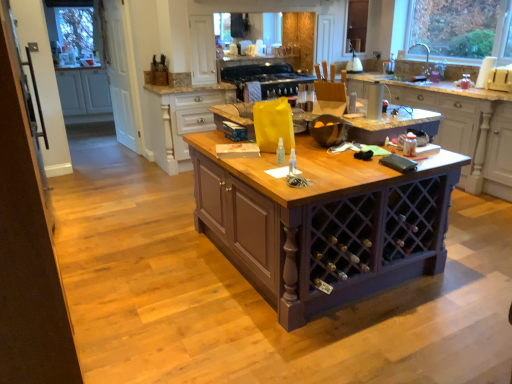
In order to face black matte bowl at center, positioned as the 2th appliance in right-to-left order, should I rotate leftwards or rightwards?

Rotate right and turn 10.013 degrees.

Where is `white glossy kettle at upper center, which ranks as the 2th appliance in bottom-to-top order`? The height and width of the screenshot is (384, 512). white glossy kettle at upper center, which ranks as the 2th appliance in bottom-to-top order is located at coordinates (354, 64).

What is the approximate height of white glossy kettle at upper center, which ranks as the 2th appliance in bottom-to-top order?

The height of white glossy kettle at upper center, which ranks as the 2th appliance in bottom-to-top order, is 11.17 inches.

This screenshot has width=512, height=384. Describe the element at coordinates (182, 119) in the screenshot. I see `white wood cabinet at upper center, which is the 2th cabinetry from back to front` at that location.

You are a GUI agent. You are given a task and a screenshot of the screen. Output one action in this format:
    pyautogui.click(x=<x>, y=<y>)
    Task: Click on the black matte bowl at center, positioned as the 2th appliance in right-to-left order
    
    Given the screenshot: What is the action you would take?
    pyautogui.click(x=329, y=130)

From the image's perspective, is clear glass window at upper right over white matte cabinet at left, the 1th cabinetry from the left?

Yes, from the image's perspective, clear glass window at upper right is over white matte cabinet at left, the 1th cabinetry from the left.

Is clear glass window at upper right directly adjacent to white matte cabinet at left, the first cabinetry from the back?

No, clear glass window at upper right is not next to white matte cabinet at left, the first cabinetry from the back.

Looking at the image, does clear glass window at upper right seem bigger or smaller compared to white matte cabinet at left, the 1th cabinetry from the left?

Considering their sizes, clear glass window at upper right takes up less space than white matte cabinet at left, the 1th cabinetry from the left.

From their relative heights in the image, would you say white glossy kettle at upper center, which is the first appliance in right-to-left order, is taller or shorter than clear glass window at upper right?

In the image, white glossy kettle at upper center, which is the first appliance in right-to-left order, appears to be shorter than clear glass window at upper right.

Looking at this image, considering the relative sizes of white glossy kettle at upper center, which ranks as the 2th appliance in bottom-to-top order, and clear glass window at upper right in the image provided, is white glossy kettle at upper center, which ranks as the 2th appliance in bottom-to-top order, thinner than clear glass window at upper right?

No, white glossy kettle at upper center, which ranks as the 2th appliance in bottom-to-top order, is not thinner than clear glass window at upper right.

Can clear glass window at upper right be found inside white glossy kettle at upper center, acting as the second appliance starting from the left?

No, clear glass window at upper right is not a part of white glossy kettle at upper center, acting as the second appliance starting from the left.

Considering the points (360, 61) and (500, 18), which point is behind, point (360, 61) or point (500, 18)?

The point (360, 61) is behind.

Is purple wood cabinet at center, the 1th cabinetry in the front-to-back sequence, completely or partially outside of purple wood table at center?

purple wood cabinet at center, the 1th cabinetry in the front-to-back sequence, lies outside purple wood table at center's area.

Is purple wood cabinet at center, the first cabinetry from the right, in contact with purple wood table at center?

No, purple wood cabinet at center, the first cabinetry from the right, is not touching purple wood table at center.

Measure the distance from purple wood cabinet at center, marked as the 3th cabinetry in a back-to-front arrangement, to purple wood table at center.

purple wood cabinet at center, marked as the 3th cabinetry in a back-to-front arrangement, is 6.60 feet from purple wood table at center.

Where is `table lying below the purple wood cabinet at center, the first cabinetry from the right (from the image's perspective)`? The width and height of the screenshot is (512, 384). table lying below the purple wood cabinet at center, the first cabinetry from the right (from the image's perspective) is located at coordinates (322, 223).

Which of these two, black matte bowl at center, the first appliance viewed from the front, or white glossy kettle at upper center, the 2th appliance when ordered from front to back, is thinner?

white glossy kettle at upper center, the 2th appliance when ordered from front to back, is thinner.

Does point (341, 142) appear closer or farther from the camera than point (352, 59)?

Point (341, 142) is closer to the camera than point (352, 59).

Is black matte bowl at center, marked as the 2th appliance in a top-to-bottom arrangement, further to the viewer compared to white glossy kettle at upper center, the 1th appliance in the back-to-front sequence?

No, the depth of black matte bowl at center, marked as the 2th appliance in a top-to-bottom arrangement, is less than that of white glossy kettle at upper center, the 1th appliance in the back-to-front sequence.

Based on the photo, from a real-world perspective, which object rests below the other?

black matte bowl at center, the 1th appliance viewed from the left, is physically lower.

Who is shorter, purple wood cabinet at center, marked as the 3th cabinetry in a back-to-front arrangement, or white matte cabinet at left, the 1th cabinetry from the left?

white matte cabinet at left, the 1th cabinetry from the left, is shorter.

Could you tell me if purple wood cabinet at center, the first cabinetry from the right, is turned towards white matte cabinet at left, the 1th cabinetry from the left?

No, purple wood cabinet at center, the first cabinetry from the right, is not oriented towards white matte cabinet at left, the 1th cabinetry from the left.

Locate an element on the screen. The image size is (512, 384). cabinetry that is the 2nd object located above the purple wood cabinet at center, which ranks as the third cabinetry in left-to-right order (from the image's perspective) is located at coordinates [84, 91].

Is white wood cabinet at upper center, marked as the second cabinetry in a front-to-back arrangement, not inside clear glass window at upper right?

Yes, white wood cabinet at upper center, marked as the second cabinetry in a front-to-back arrangement, is located beyond the bounds of clear glass window at upper right.

The image size is (512, 384). Find the location of `cabinetry that is the 2nd one when counting leftward from the clear glass window at upper right`. cabinetry that is the 2nd one when counting leftward from the clear glass window at upper right is located at coordinates (182, 119).

Which of these two, white wood cabinet at upper center, which is the 2th cabinetry in right-to-left order, or clear glass window at upper right, is wider?

white wood cabinet at upper center, which is the 2th cabinetry in right-to-left order, is wider.

From a real-world perspective, does white wood cabinet at upper center, which appears as the second cabinetry when viewed from the left, stand above clear glass window at upper right?

No.

Considering the sizes of objects black matte bowl at center, the first appliance viewed from the front, and white matte cabinet at left, the first cabinetry from the back, in the image provided, who is taller, black matte bowl at center, the first appliance viewed from the front, or white matte cabinet at left, the first cabinetry from the back,?

With more height is white matte cabinet at left, the first cabinetry from the back.

From the image's perspective, between black matte bowl at center, the 1th appliance viewed from the left, and white matte cabinet at left, the first cabinetry from the back, who is located below?

black matte bowl at center, the 1th appliance viewed from the left.

Considering the positions of points (340, 124) and (86, 75), is point (340, 124) closer to camera compared to point (86, 75)?

Yes, it is in front of point (86, 75).

Looking at this image, how many degrees apart are the facing directions of black matte bowl at center, arranged as the 1th appliance when ordered from the bottom, and white matte cabinet at left, marked as the third cabinetry in a front-to-back arrangement?

The angular difference between black matte bowl at center, arranged as the 1th appliance when ordered from the bottom, and white matte cabinet at left, marked as the third cabinetry in a front-to-back arrangement, is 42.6 degrees.

Locate an element on the screen. This screenshot has width=512, height=384. window on the right of white matte cabinet at left, the first cabinetry from the back is located at coordinates pyautogui.click(x=462, y=28).

Image resolution: width=512 pixels, height=384 pixels. I want to click on the 1st appliance counting from the left side of the clear glass window at upper right, so click(x=354, y=64).

Which object lies nearer to the anchor point white glossy kettle at upper center, the first appliance viewed from the top, black matte stove at upper center or black matte bowl at center, arranged as the 1th appliance when ordered from the bottom?

black matte stove at upper center is closer to white glossy kettle at upper center, the first appliance viewed from the top.

Consider the image. Looking at the image, which one is located further to white wood cabinet at upper center, which is the 2th cabinetry in right-to-left order, purple wood table at center or white matte cabinet at left, which is the third cabinetry from right to left?

Among the two, white matte cabinet at left, which is the third cabinetry from right to left, is located further to white wood cabinet at upper center, which is the 2th cabinetry in right-to-left order.

Considering their positions, is clear glass window at upper right positioned further to white wood cabinet at upper center, which is the 2th cabinetry in right-to-left order, than purple wood cabinet at center, the 1th cabinetry in the front-to-back sequence?

clear glass window at upper right.

Based on their spatial positions, is purple wood table at center or black matte bowl at center, positioned as the 2th appliance in right-to-left order, closer to black matte stove at upper center?

black matte bowl at center, positioned as the 2th appliance in right-to-left order, is positioned closer to the anchor black matte stove at upper center.

Looking at this image, based on their spatial positions, is purple wood cabinet at center, marked as the 3th cabinetry in a back-to-front arrangement, or white glossy kettle at upper center, which is the first appliance in right-to-left order, further from purple wood table at center?

Among the two, white glossy kettle at upper center, which is the first appliance in right-to-left order, is located further to purple wood table at center.

Based on their spatial positions, is black matte stove at upper center or clear glass door at left closer to white matte cabinet at left, the 1th cabinetry from the left?

clear glass door at left.

Looking at this image, when comparing their distances from black matte stove at upper center, does clear glass window at upper right or white matte cabinet at left, the first cabinetry from the back, seem closer?

clear glass window at upper right is positioned closer to the anchor black matte stove at upper center.

Based on their spatial positions, is clear glass window at upper right or black matte bowl at center, the 2th appliance from the back, further from white matte cabinet at left, marked as the third cabinetry in a front-to-back arrangement?

Among the two, black matte bowl at center, the 2th appliance from the back, is located further to white matte cabinet at left, marked as the third cabinetry in a front-to-back arrangement.

You are a GUI agent. You are given a task and a screenshot of the screen. Output one action in this format:
    pyautogui.click(x=<x>, y=<y>)
    Task: Click on the table between white matte cabinet at left, which is the third cabinetry from right to left, and clear glass window at upper right from left to right
    This screenshot has width=512, height=384.
    Given the screenshot: What is the action you would take?
    pyautogui.click(x=322, y=223)

The height and width of the screenshot is (384, 512). What are the coordinates of `appliance located between purple wood table at center and white wood cabinet at upper center, which appears as the second cabinetry when viewed from the left, in the depth direction` in the screenshot? It's located at (x=329, y=130).

Find the location of a particular element. glass door situated between white matte cabinet at left, the first cabinetry from the back, and white glossy kettle at upper center, the 2th appliance when ordered from front to back, from left to right is located at coordinates (120, 74).

I want to click on kitchen appliance situated between white matte cabinet at left, the 1th cabinetry from the left, and clear glass window at upper right from left to right, so click(x=266, y=78).